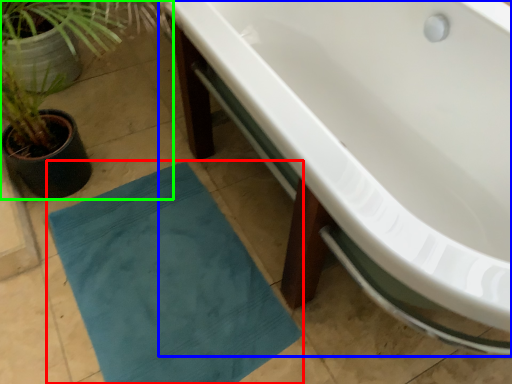
Question: Which object is positioned closest to bath mat (highlighted by a red box)? Select from bathtub (highlighted by a blue box) and houseplant (highlighted by a green box).

Choices:
 (A) bathtub
 (B) houseplant

Answer: (B)